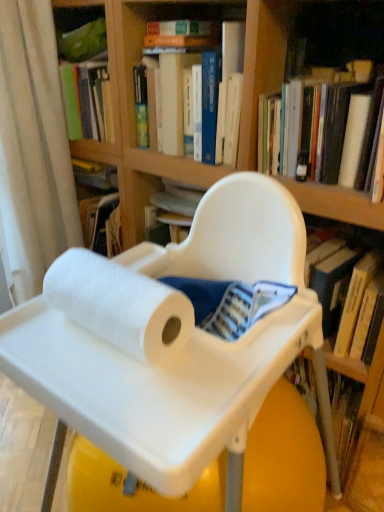
Question: In terms of width, does white matte book at upper right, acting as the 2th book starting from the left, look wider or thinner when compared to white fabric curtain at left?

Choices:
 (A) wide
 (B) thin

Answer: (A)

Question: In terms of height, does white matte book at upper right, which is counted as the 1th book, starting from the right, look taller or shorter compared to white fabric curtain at left?

Choices:
 (A) short
 (B) tall

Answer: (A)

Question: Which object is positioned farthest from the white matte book at upper right, acting as the 2th book starting from the left?

Choices:
 (A) white fabric curtain at left
 (B) white plastic tray at center
 (C) white paper towel at center
 (D) blue hardcover book at upper center, the 2th book positioned from the right

Answer: (A)

Question: Based on their relative distances, which object is nearer to the white paper towel at center?

Choices:
 (A) blue hardcover book at upper center, which ranks as the first book in left-to-right order
 (B) white plastic tray at center
 (C) white matte book at upper right, acting as the 2th book starting from the left
 (D) white fabric curtain at left

Answer: (B)